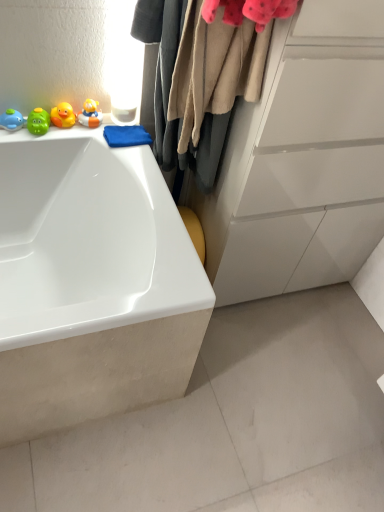
You are a GUI agent. You are given a task and a screenshot of the screen. Output one action in this format:
    pyautogui.click(x=<x>, y=<y>)
    Task: Click on the rubber duck at left, which is counted as the 3th toy, starting from the left
    The width and height of the screenshot is (384, 512).
    Given the screenshot: What is the action you would take?
    pyautogui.click(x=63, y=115)

What do you see at coordinates (91, 283) in the screenshot? I see `white glossy bathtub at upper left` at bounding box center [91, 283].

I want to click on beige woolen sweater at upper center, so click(x=204, y=72).

The width and height of the screenshot is (384, 512). Find the location of `blue microfiber cloth at upper left`. blue microfiber cloth at upper left is located at coordinates (126, 136).

In order to face matte green rubber duck at left, which is counted as the 3th toy, starting from the right, should I rotate leftwards or rightwards?

You should rotate left by 19.968 degrees.

The width and height of the screenshot is (384, 512). I want to click on rubber duck at left, which is the second toy in right-to-left order, so click(x=63, y=115).

From a real-world perspective, is matte green rubber duck at left, the second toy positioned from the left, on beige woolen sweater at upper center?

Incorrect, from a real-world perspective, matte green rubber duck at left, the second toy positioned from the left, is lower than beige woolen sweater at upper center.

How many degrees apart are the facing directions of matte green rubber duck at left, the second toy positioned from the left, and beige woolen sweater at upper center?

There is a 88.5-degree angle between the facing directions of matte green rubber duck at left, the second toy positioned from the left, and beige woolen sweater at upper center.

Is the surface of matte green rubber duck at left, which is counted as the 3th toy, starting from the right, in direct contact with beige woolen sweater at upper center?

No, matte green rubber duck at left, which is counted as the 3th toy, starting from the right, is not in contact with beige woolen sweater at upper center.

Considering the relative positions of matte green rubber duck at left, which is counted as the 3th toy, starting from the right, and beige woolen sweater at upper center in the image provided, is matte green rubber duck at left, which is counted as the 3th toy, starting from the right, to the left or to the right of beige woolen sweater at upper center?

Clearly, matte green rubber duck at left, which is counted as the 3th toy, starting from the right, is on the left of beige woolen sweater at upper center in the image.

Considering the sizes of rubber duck at left, which is the second toy in right-to-left order, and blue microfiber cloth at upper left in the image, is rubber duck at left, which is the second toy in right-to-left order, taller or shorter than blue microfiber cloth at upper left?

Considering their sizes, rubber duck at left, which is the second toy in right-to-left order, has more height than blue microfiber cloth at upper left.

How distant is rubber duck at left, which is counted as the 3th toy, starting from the left, from blue microfiber cloth at upper left?

rubber duck at left, which is counted as the 3th toy, starting from the left, and blue microfiber cloth at upper left are 6.44 inches apart from each other.

Can you confirm if rubber duck at left, which is counted as the 3th toy, starting from the left, is thinner than blue microfiber cloth at upper left?

Yes.

What's the angular difference between rubber duck at left, which is counted as the 3th toy, starting from the left, and blue microfiber cloth at upper left's facing directions?

They differ by 4.57e-05 degrees in their facing directions.

In terms of height, does rubber duck at upper left, the 4th toy in the left-to-right sequence, look taller or shorter compared to rubber duck at left, which is counted as the 3th toy, starting from the left?

rubber duck at upper left, the 4th toy in the left-to-right sequence, is shorter than rubber duck at left, which is counted as the 3th toy, starting from the left.

Which is more distant, (92, 109) or (57, 109)?

The point (92, 109) is farther from the camera.

Is rubber duck at upper left, which ranks as the 1th toy in right-to-left order, closer to camera compared to rubber duck at left, which is the second toy in right-to-left order?

No, the depth of rubber duck at upper left, which ranks as the 1th toy in right-to-left order, is greater than that of rubber duck at left, which is the second toy in right-to-left order.

From the image's perspective, is rubber duck at upper left, the 4th toy in the left-to-right sequence, on top of rubber duck at left, which is the second toy in right-to-left order?

Yes, from the image's perspective, rubber duck at upper left, the 4th toy in the left-to-right sequence, is on top of rubber duck at left, which is the second toy in right-to-left order.

Is point (20, 121) closer to camera compared to point (40, 109)?

Yes, it is in front of point (40, 109).

Looking at this image, is matte green rubber duck at left, which is counted as the 3th toy, starting from the right, completely or partially inside matte blue whale at upper left, which ranks as the 1th toy in left-to-right order?

No, matte green rubber duck at left, which is counted as the 3th toy, starting from the right, is not a part of matte blue whale at upper left, which ranks as the 1th toy in left-to-right order.

From the image's perspective, would you say matte blue whale at upper left, acting as the 4th toy starting from the right, is positioned over matte green rubber duck at left, the second toy positioned from the left?

No, from the image's perspective, matte blue whale at upper left, acting as the 4th toy starting from the right, is not on top of matte green rubber duck at left, the second toy positioned from the left.

Is matte blue whale at upper left, acting as the 4th toy starting from the right, looking in the opposite direction of matte green rubber duck at left, which is counted as the 3th toy, starting from the right?

matte blue whale at upper left, acting as the 4th toy starting from the right, is not turned away from matte green rubber duck at left, which is counted as the 3th toy, starting from the right.

How many degrees apart are the facing directions of matte green rubber duck at left, the second toy positioned from the left, and blue microfiber cloth at upper left?

They differ by 3.21e-05 degrees in their facing directions.

From the picture: In the image, is matte green rubber duck at left, the second toy positioned from the left, positioned in front of or behind blue microfiber cloth at upper left?

Visually, matte green rubber duck at left, the second toy positioned from the left, is located in front of blue microfiber cloth at upper left.

From a real-world perspective, relative to blue microfiber cloth at upper left, is matte green rubber duck at left, the second toy positioned from the left, vertically above or below?

matte green rubber duck at left, the second toy positioned from the left, is above blue microfiber cloth at upper left.

Between point (42, 117) and point (118, 142), which one is positioned in front?

Positioned in front is point (42, 117).

Who is taller, matte green rubber duck at left, which is counted as the 3th toy, starting from the right, or rubber duck at upper left, which ranks as the 1th toy in right-to-left order?

rubber duck at upper left, which ranks as the 1th toy in right-to-left order.

What's the angular difference between matte green rubber duck at left, which is counted as the 3th toy, starting from the right, and rubber duck at upper left, the 4th toy in the left-to-right sequence,'s facing directions?

They differ by 4.66e-05 degrees in their facing directions.

Is matte green rubber duck at left, which is counted as the 3th toy, starting from the right, in front of rubber duck at upper left, which ranks as the 1th toy in right-to-left order?

Yes, it is in front of rubber duck at upper left, which ranks as the 1th toy in right-to-left order.

Is point (56, 119) positioned behind point (7, 293)?

No, it is in front of (7, 293).

Is rubber duck at left, which is counted as the 3th toy, starting from the left, taller or shorter than white glossy bathtub at upper left?

In the image, rubber duck at left, which is counted as the 3th toy, starting from the left, appears to be shorter than white glossy bathtub at upper left.

In order to click on the 4th toy above the white glossy bathtub at upper left (from a real-world perspective) in this screenshot , I will do `click(63, 115)`.

Does rubber duck at left, which is the second toy in right-to-left order, come behind white glossy bathtub at upper left?

Yes.

Where is `laundry above the matte green rubber duck at left, the second toy positioned from the left (from a real-world perspective)`? The height and width of the screenshot is (512, 384). laundry above the matte green rubber duck at left, the second toy positioned from the left (from a real-world perspective) is located at coordinates pos(204,72).

There is a blue microfiber cloth at upper left. At what (x,y) coordinates should I click in order to perform the action: click on the 3rd toy above it (from the image's perspective). Please return your answer as a coordinate pair (x, y). Image resolution: width=384 pixels, height=512 pixels. Looking at the image, I should click on (63, 115).

Considering their positions, is matte blue whale at upper left, which ranks as the 1th toy in left-to-right order, positioned further to beige woolen sweater at upper center than white glossy bathtub at upper left?

The object further to beige woolen sweater at upper center is matte blue whale at upper left, which ranks as the 1th toy in left-to-right order.

Estimate the real-world distances between objects in this image. Which object is closer to matte blue whale at upper left, which ranks as the 1th toy in left-to-right order, white glossy bathtub at upper left or matte green rubber duck at left, the second toy positioned from the left?

matte green rubber duck at left, the second toy positioned from the left, is closer to matte blue whale at upper left, which ranks as the 1th toy in left-to-right order.

When comparing their distances from matte blue whale at upper left, acting as the 4th toy starting from the right, does matte green rubber duck at left, which is counted as the 3th toy, starting from the right, or rubber duck at upper left, which ranks as the 1th toy in right-to-left order, seem further?

Based on the image, rubber duck at upper left, which ranks as the 1th toy in right-to-left order, appears to be further to matte blue whale at upper left, acting as the 4th toy starting from the right.

Based on their spatial positions, is rubber duck at upper left, which ranks as the 1th toy in right-to-left order, or matte blue whale at upper left, which ranks as the 1th toy in left-to-right order, closer to white glossy bathtub at upper left?

Among the two, rubber duck at upper left, which ranks as the 1th toy in right-to-left order, is located nearer to white glossy bathtub at upper left.

In the scene shown: Based on their spatial positions, is white glossy bathtub at upper left or rubber duck at upper left, which ranks as the 1th toy in right-to-left order, further from matte blue whale at upper left, acting as the 4th toy starting from the right?

white glossy bathtub at upper left lies further to matte blue whale at upper left, acting as the 4th toy starting from the right, than the other object.

Which object lies nearer to the anchor point rubber duck at left, which is counted as the 3th toy, starting from the left, white glossy bathtub at upper left or rubber duck at upper left, which ranks as the 1th toy in right-to-left order?

Among the two, rubber duck at upper left, which ranks as the 1th toy in right-to-left order, is located nearer to rubber duck at left, which is counted as the 3th toy, starting from the left.

Estimate the real-world distances between objects in this image. Which object is closer to beige woolen sweater at upper center, white glossy bathtub at upper left or rubber duck at upper left, which ranks as the 1th toy in right-to-left order?

rubber duck at upper left, which ranks as the 1th toy in right-to-left order, is positioned closer to the anchor beige woolen sweater at upper center.

From the image, which object appears to be farther from matte green rubber duck at left, which is counted as the 3th toy, starting from the right, blue microfiber cloth at upper left or rubber duck at upper left, the 4th toy in the left-to-right sequence?

Among the two, blue microfiber cloth at upper left is located further to matte green rubber duck at left, which is counted as the 3th toy, starting from the right.

Identify the location of bathtub between beige woolen sweater at upper center and blue microfiber cloth at upper left along the z-axis. (91, 283).

Identify the location of toy between matte blue whale at upper left, acting as the 4th toy starting from the right, and rubber duck at left, which is the second toy in right-to-left order, in the horizontal direction. This screenshot has width=384, height=512. (38, 122).

Find the location of a particular element. The width and height of the screenshot is (384, 512). bathtub located between matte blue whale at upper left, acting as the 4th toy starting from the right, and beige woolen sweater at upper center in the left-right direction is located at coordinates (91, 283).

Locate an element on the screen. The height and width of the screenshot is (512, 384). toy between rubber duck at left, which is the second toy in right-to-left order, and blue microfiber cloth at upper left, in the horizontal direction is located at coordinates (90, 114).